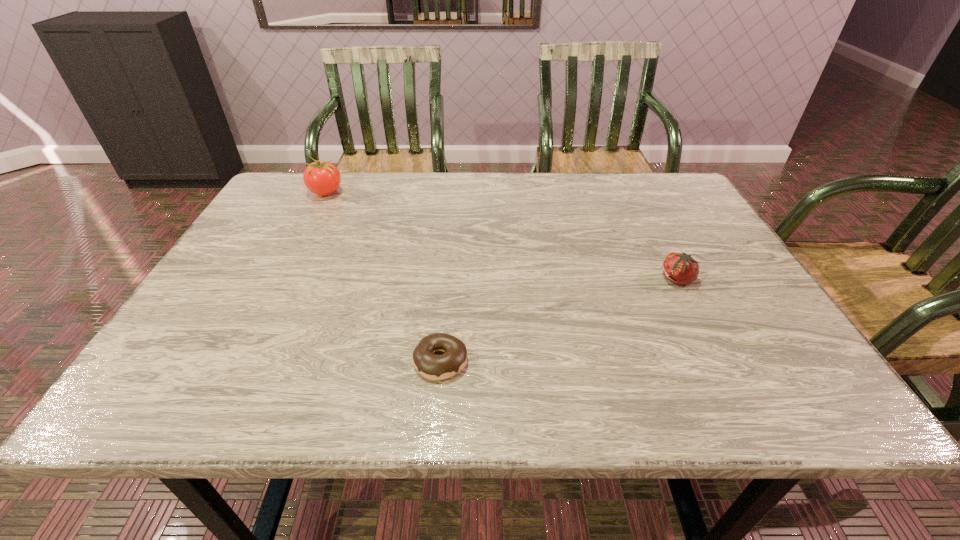
What are the coordinates of `the left tomato` in the screenshot? It's located at (322, 178).

The height and width of the screenshot is (540, 960). In order to click on the taller tomato in this screenshot , I will do `click(322, 178)`.

In order to click on the right tomato in this screenshot , I will do `click(680, 268)`.

Find the location of a particular element. This screenshot has height=540, width=960. the rightmost object is located at coordinates (680, 268).

You are a GUI agent. You are given a task and a screenshot of the screen. Output one action in this format:
    pyautogui.click(x=<x>, y=<y>)
    Task: Click on the second object from right to left
    The image size is (960, 540).
    Given the screenshot: What is the action you would take?
    pyautogui.click(x=433, y=367)

Where is `the nearest object`? Image resolution: width=960 pixels, height=540 pixels. the nearest object is located at coordinates (433, 367).

Where is `free region located on the right of the taller tomato`? free region located on the right of the taller tomato is located at coordinates (449, 192).

Where is `vacant region located 0.380m on the left of the second nearest object`? vacant region located 0.380m on the left of the second nearest object is located at coordinates (493, 279).

Locate an element on the screen. vacant region located 0.330m on the left of the doughnut is located at coordinates (238, 361).

Locate an element on the screen. This screenshot has height=540, width=960. object that is at the far edge is located at coordinates (322, 178).